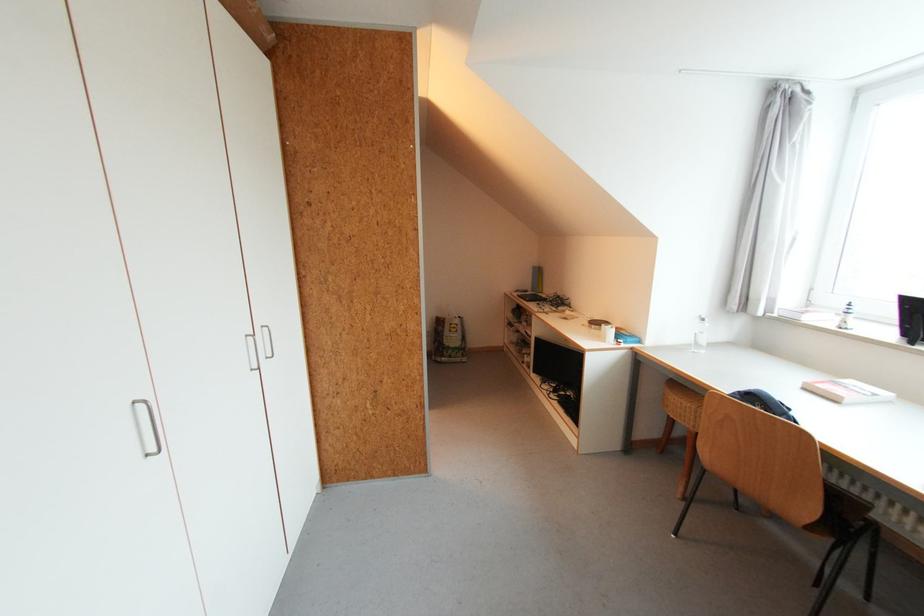
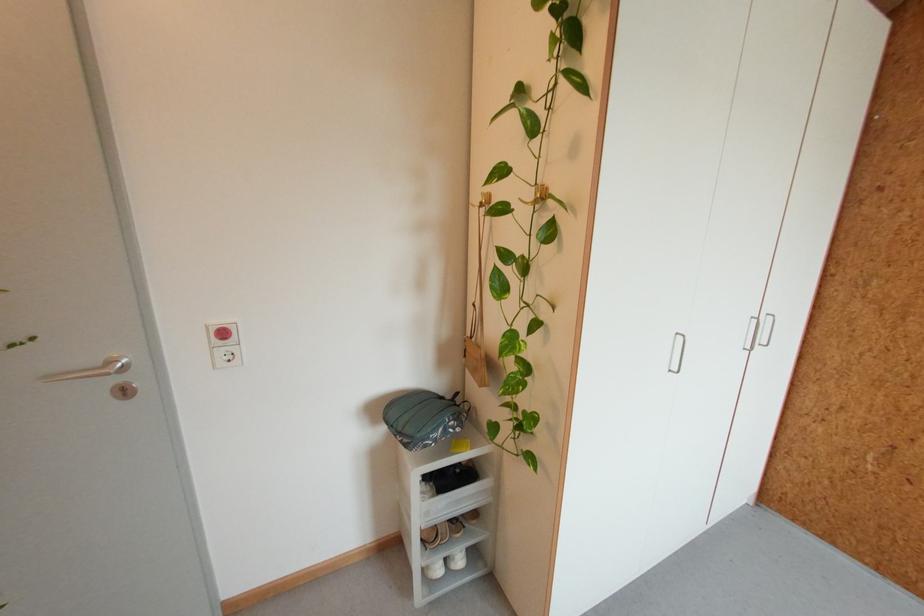
Find the pixel in the second image that matches point 152,456 in the first image.

(675, 371)